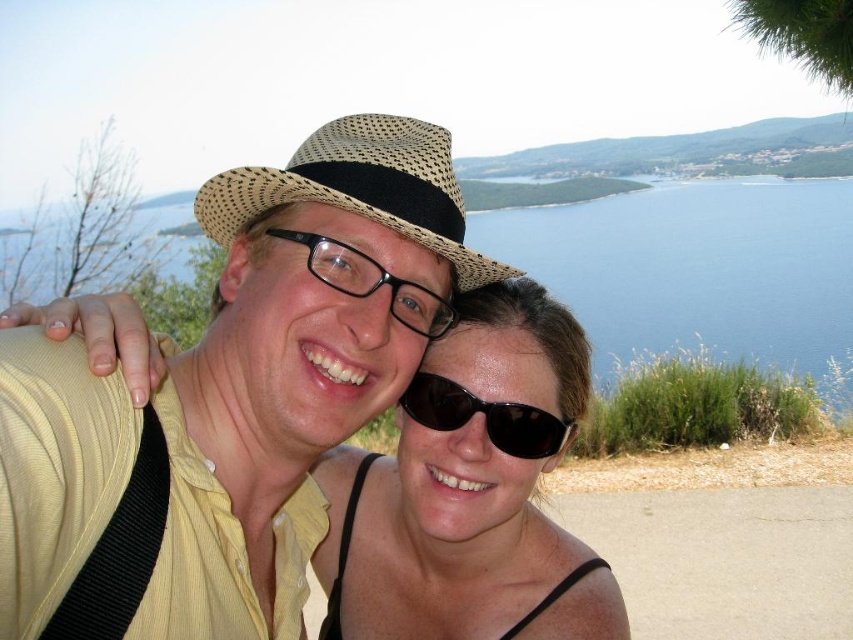
Consider the image. Can you confirm if blue water at upper center is smaller than black plastic glasses at center?

Incorrect, blue water at upper center is not smaller in size than black plastic glasses at center.

Measure the distance between blue water at upper center and camera.

They are 35.67 feet apart.

Between point (654, 314) and point (273, 228), which one is positioned behind?

The point (654, 314) is more distant.

The height and width of the screenshot is (640, 853). I want to click on blue water at upper center, so click(x=698, y=268).

Does sunglasses at center have a greater height compared to natural straw hat at center?

Indeed, sunglasses at center has a greater height compared to natural straw hat at center.

Which is behind, point (578, 579) or point (422, 122)?

Positioned behind is point (578, 579).

You are a GUI agent. You are given a task and a screenshot of the screen. Output one action in this format:
    pyautogui.click(x=<x>, y=<y>)
    Task: Click on the sunglasses at center
    This screenshot has height=640, width=853.
    Given the screenshot: What is the action you would take?
    pyautogui.click(x=469, y=492)

What do you see at coordinates (231, 401) in the screenshot? This screenshot has height=640, width=853. I see `matte straw hat at center` at bounding box center [231, 401].

Is matte straw hat at center bigger than sunglasses at center?

Yes, matte straw hat at center is bigger than sunglasses at center.

Find the location of `matte straw hat at center`. matte straw hat at center is located at coordinates (231, 401).